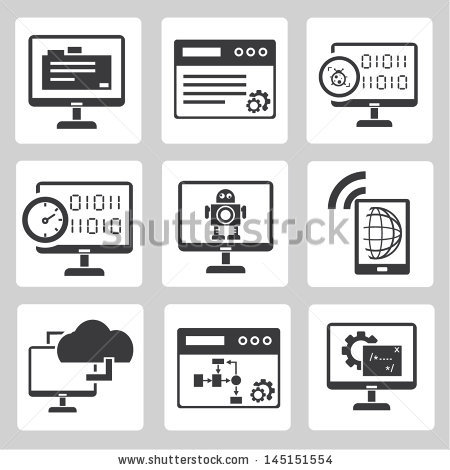
I want to click on images of a computer monitor, so click(x=76, y=72), click(x=376, y=77), click(x=90, y=214), click(x=223, y=213), click(x=366, y=352), click(x=59, y=374).